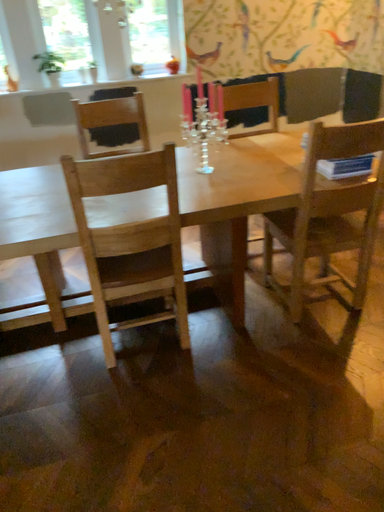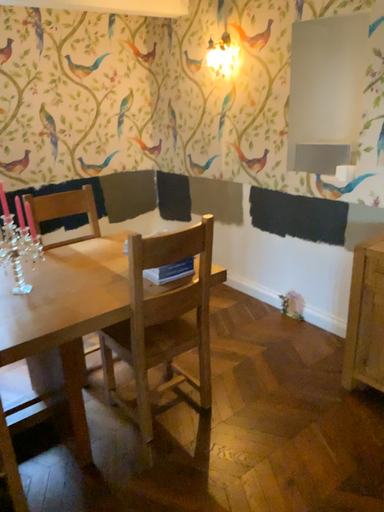
Question: How did the camera likely rotate when shooting the video?

Choices:
 (A) rotated upward
 (B) rotated downward

Answer: (A)